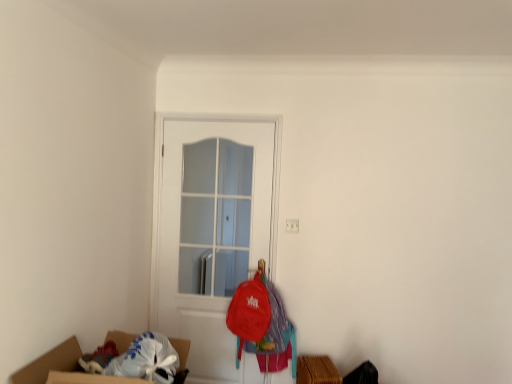
Question: Choose the correct answer: Is matte red backpack at center inside white glossy door at center or outside it?

Choices:
 (A) inside
 (B) outside

Answer: (B)

Question: In terms of size, does matte red backpack at center appear bigger or smaller than white glossy door at center?

Choices:
 (A) big
 (B) small

Answer: (B)

Question: Is point (254, 324) positioned closer to the camera than point (157, 286)?

Choices:
 (A) closer
 (B) farther

Answer: (A)

Question: From a real-world perspective, is white glossy door at center positioned above or below matte red backpack at center?

Choices:
 (A) below
 (B) above

Answer: (B)

Question: Considering the positions of white glossy door at center and matte red backpack at center in the image, is white glossy door at center bigger or smaller than matte red backpack at center?

Choices:
 (A) small
 (B) big

Answer: (B)

Question: Considering the positions of white glossy door at center and matte red backpack at center in the image, is white glossy door at center taller or shorter than matte red backpack at center?

Choices:
 (A) tall
 (B) short

Answer: (A)

Question: Is point (266, 198) closer or farther from the camera than point (275, 299)?

Choices:
 (A) farther
 (B) closer

Answer: (A)